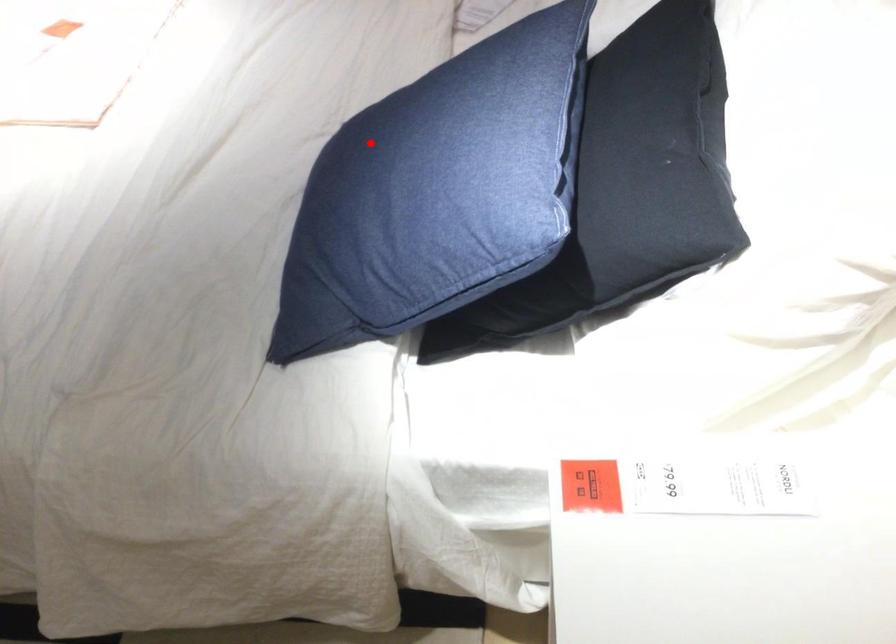
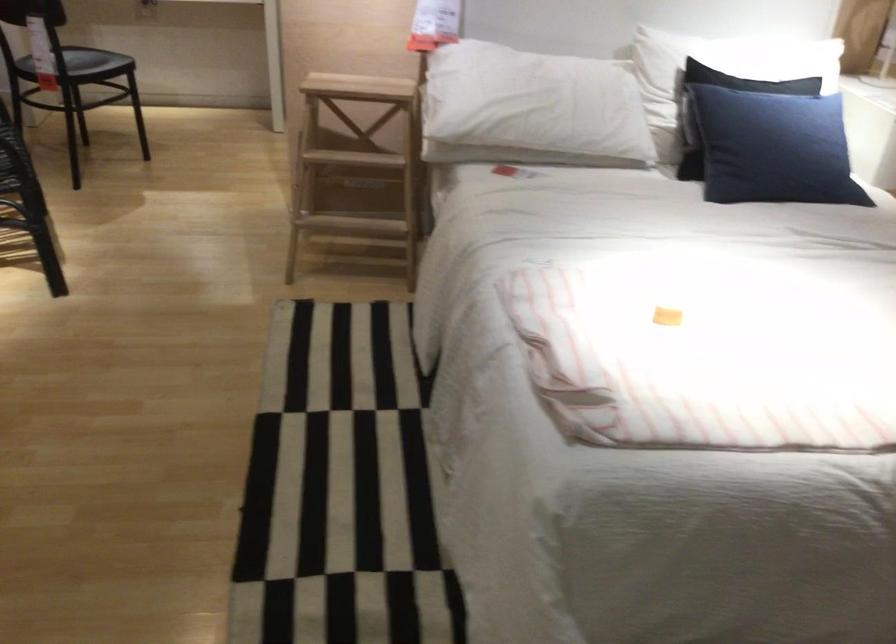
Locate, in the second image, the point that corresponds to the highlighted location in the first image.

(773, 147)